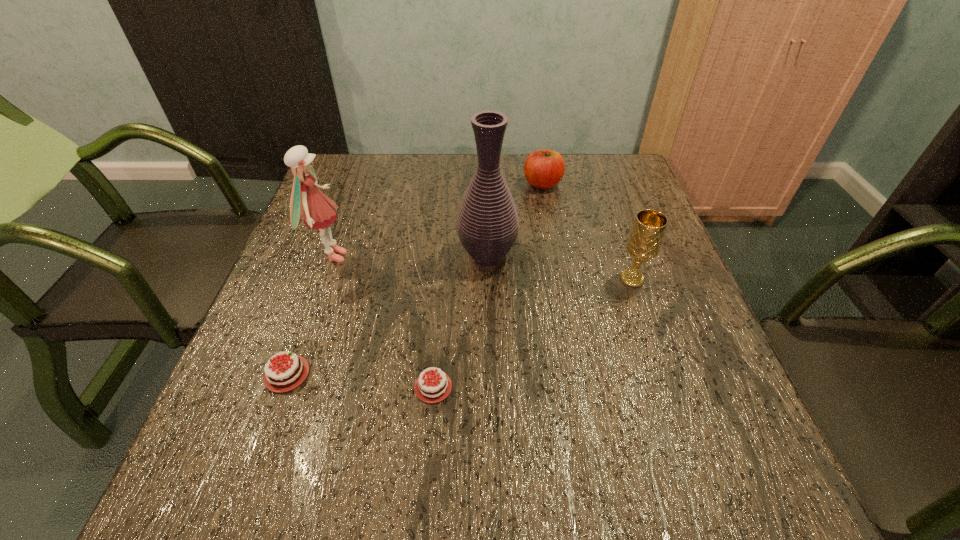
Locate an element on the screen. This screenshot has width=960, height=540. vacant space that satisfies the following two spatial constraints: 1. on the back side of the taller chocolate cake; 2. on the right side of the third tallest object is located at coordinates pos(321,279).